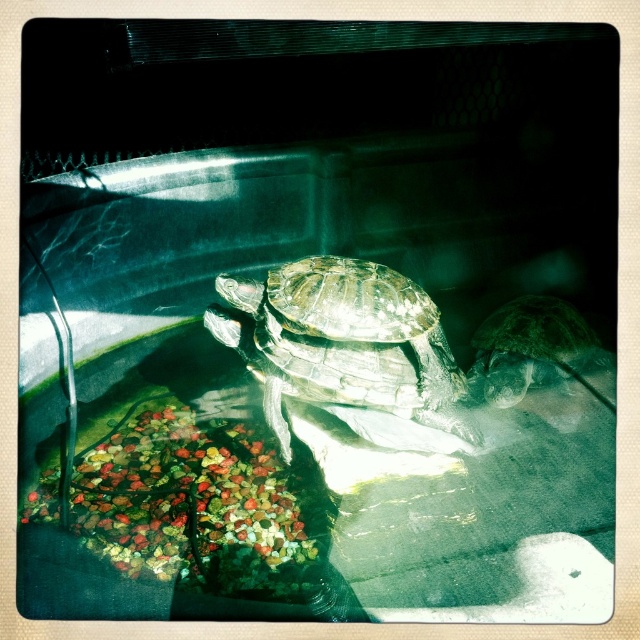
Can you confirm if shiny brown tortoise at center is thinner than shiny green tortoise at right?

No.

Is shiny brown tortoise at center above shiny green tortoise at right?

Yes, shiny brown tortoise at center is above shiny green tortoise at right.

Measure the distance between shiny brown tortoise at center and camera.

A distance of 2.05 meters exists between shiny brown tortoise at center and camera.

Find the location of a particular element. The width and height of the screenshot is (640, 640). shiny brown tortoise at center is located at coordinates (346, 344).